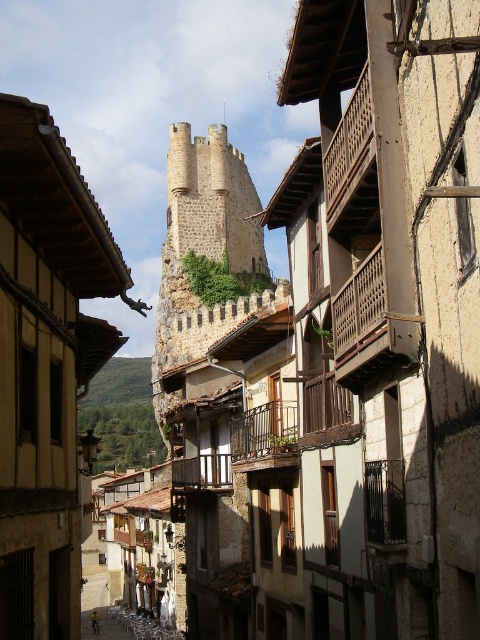
Is point (160, 374) closer to camera compared to point (335, 182)?

No, (160, 374) is further to viewer.

Does stone tower at center have a lesser height compared to wooden at upper center?

No, stone tower at center is not shorter than wooden at upper center.

Describe the element at coordinates (203, 248) in the screenshot. Image resolution: width=480 pixels, height=640 pixels. I see `stone tower at center` at that location.

You are a GUI agent. You are given a task and a screenshot of the screen. Output one action in this format:
    pyautogui.click(x=<x>, y=<y>)
    Task: Click on the stone tower at center
    
    Given the screenshot: What is the action you would take?
    pyautogui.click(x=203, y=248)

Is wooden at upper center closer to the viewer compared to brown wooden balcony at center?

Yes, it is in front of brown wooden balcony at center.

Who is positioned more to the left, wooden at upper center or brown wooden balcony at center?

brown wooden balcony at center is more to the left.

Where is `wooden at upper center`? The height and width of the screenshot is (640, 480). wooden at upper center is located at coordinates (351, 164).

Find the location of `wooden at upper center`. wooden at upper center is located at coordinates (351, 164).

Is stone tower at center below brown wooden balcony at center?

Actually, stone tower at center is above brown wooden balcony at center.

Between point (171, 221) and point (252, 420), which one is positioned behind?

The point (171, 221) is more distant.

Is point (162, 326) positioned after point (282, 456)?

Yes, point (162, 326) is behind point (282, 456).

At what (x,y) coordinates should I click in order to perform the action: click on stone tower at center. Please return your answer as a coordinate pair (x, y). Image resolution: width=480 pixels, height=640 pixels. Looking at the image, I should click on (203, 248).